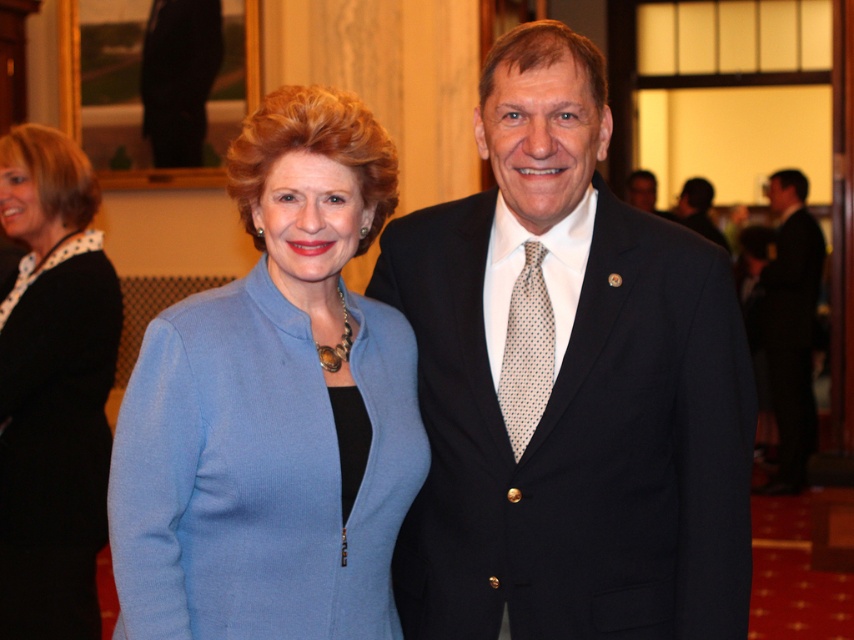
Does black suit at center appear under black suit at right?

Indeed, black suit at center is positioned under black suit at right.

Between point (688, 508) and point (797, 449), which one is positioned in front?

Positioned in front is point (688, 508).

Find the location of a particular element. black suit at center is located at coordinates (572, 394).

Which is above, blue woolen jacket at center or matte black blazer at center?

blue woolen jacket at center is above.

Is blue woolen jacket at center further to camera compared to matte black blazer at center?

That is False.

The image size is (854, 640). Find the location of `blue woolen jacket at center`. blue woolen jacket at center is located at coordinates (273, 406).

Is point (10, 602) behind point (531, 266)?

Yes, point (10, 602) is farther from viewer.

Is matte black blazer at center to the right of brown dotted tie at center from the viewer's perspective?

Incorrect, matte black blazer at center is not on the right side of brown dotted tie at center.

Does point (98, 612) lie in front of point (509, 346)?

No, it is not.

At what (x,y) coordinates should I click in order to perform the action: click on matte black blazer at center. Please return your answer as a coordinate pair (x, y). This screenshot has width=854, height=640. Looking at the image, I should click on (51, 388).